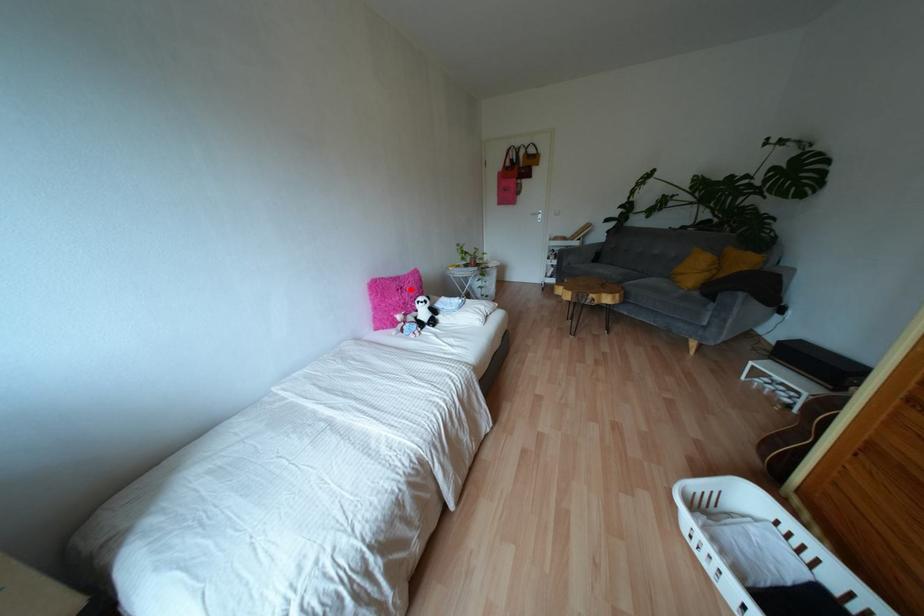
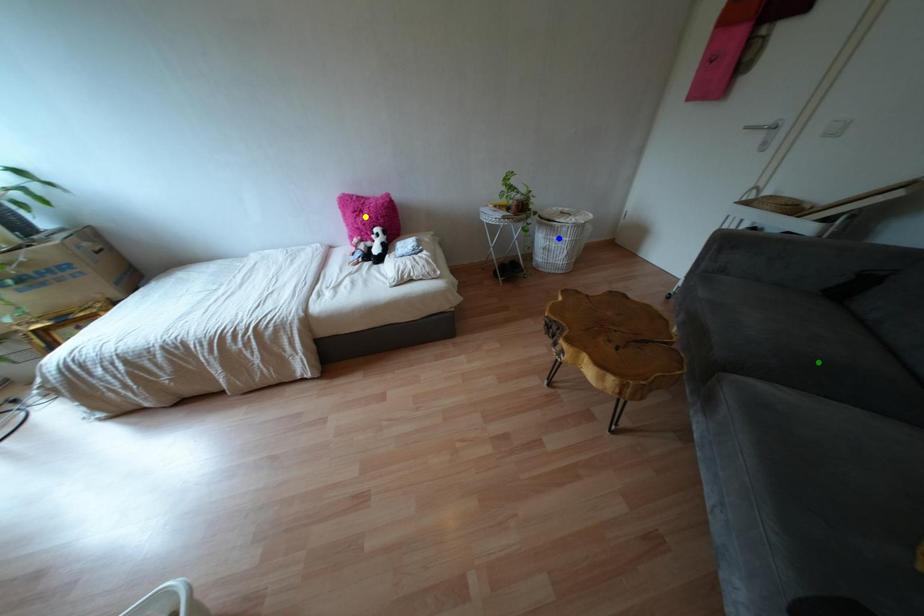
Question: I am providing you with two images of the same scene from different viewpoints. A red point is marked on the first image. You are given multiple points on the second image. Which point in image 2 represents the same 3d spot as the red point in image 1?

Choices:
 (A) yellow point
 (B) blue point
 (C) green point

Answer: (A)